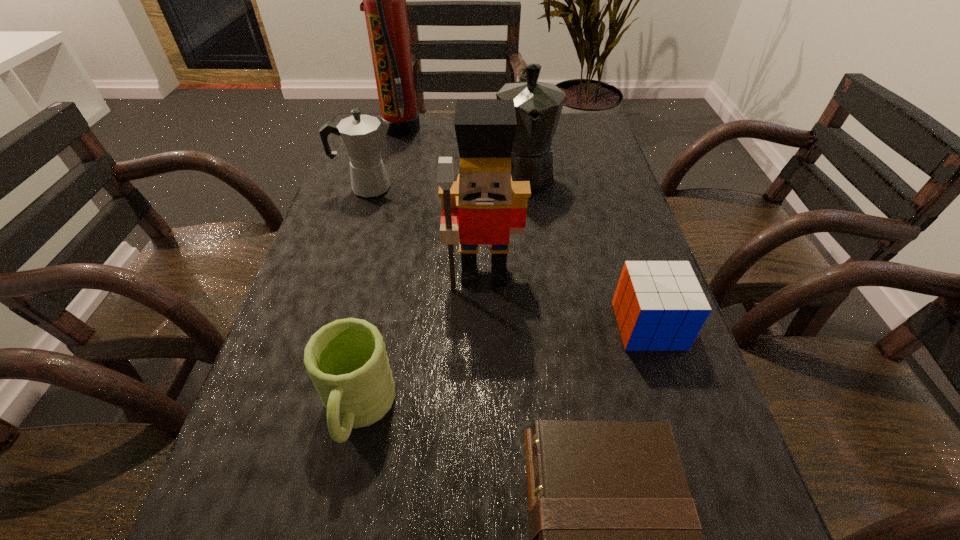
Locate an element on the screen. Image resolution: width=960 pixels, height=540 pixels. coffeepot that is at the left edge is located at coordinates (362, 135).

The height and width of the screenshot is (540, 960). I want to click on mug that is positioned at the left edge, so click(347, 362).

This screenshot has height=540, width=960. Find the location of `object that is at the right edge`. object that is at the right edge is located at coordinates (659, 305).

Identify the location of object located in the far left corner section of the desktop. (384, 0).

Locate an element on the screen. vacant region at the left edge is located at coordinates (310, 460).

Where is `vacant space at the right edge of the desktop`? vacant space at the right edge of the desktop is located at coordinates (612, 240).

Where is `free space between the cube and the shorter coffeepot`? This screenshot has height=540, width=960. free space between the cube and the shorter coffeepot is located at coordinates (508, 257).

Locate an element on the screen. Image resolution: width=960 pixels, height=540 pixels. free area in between the left coffeepot and the fourth nearest object is located at coordinates (426, 231).

At what (x,y) coordinates should I click in order to perform the action: click on vacant region between the second shortest object and the shorter coffeepot. Please return your answer as a coordinate pair (x, y). The image size is (960, 540). Looking at the image, I should click on pos(508,257).

Locate an element on the screen. free space between the fifth farthest object and the nutcracker is located at coordinates (566, 300).